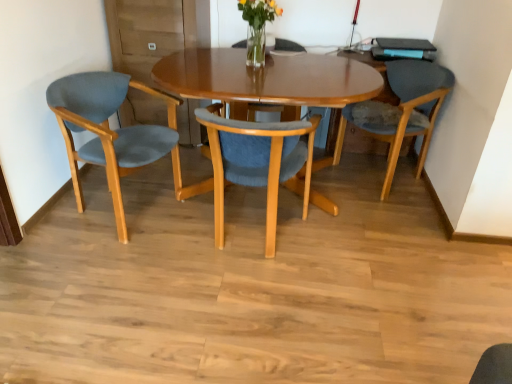
Question: Is translucent glass vase at upper center inside or outside of matte wood chair at center, positioned as the 2th chair in right-to-left order?

Choices:
 (A) outside
 (B) inside

Answer: (A)

Question: Is point (258, 41) closer or farther from the camera than point (271, 218)?

Choices:
 (A) closer
 (B) farther

Answer: (B)

Question: Which of these objects is positioned closest to the matte blue cushioned chair at right, the 1th chair viewed from the right?

Choices:
 (A) translucent glass vase at upper center
 (B) matte wood chair at center, acting as the 2th chair starting from the left
 (C) matte blue fabric chair at left, arranged as the 3th chair when viewed from the right

Answer: (B)

Question: Which is farther from the matte blue fabric chair at left, arranged as the 3th chair when viewed from the right?

Choices:
 (A) matte blue cushioned chair at right, the 1th chair viewed from the right
 (B) matte wood chair at center, acting as the 2th chair starting from the left
 (C) translucent glass vase at upper center

Answer: (A)